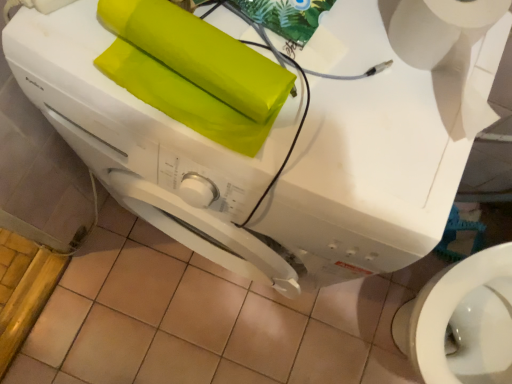
This screenshot has width=512, height=384. Find the location of `white matte toilet paper at upper right`. white matte toilet paper at upper right is located at coordinates (451, 46).

The height and width of the screenshot is (384, 512). What do you see at coordinates (451, 46) in the screenshot?
I see `white matte toilet paper at upper right` at bounding box center [451, 46].

What is the approximate height of white matte toilet paper at upper right?

The height of white matte toilet paper at upper right is 3.84 inches.

You are a GUI agent. You are given a task and a screenshot of the screen. Output one action in this format:
    pyautogui.click(x=<x>, y=<y>)
    Task: Click on the white matte toilet paper at upper right
    This screenshot has height=384, width=512.
    Given the screenshot: What is the action you would take?
    pyautogui.click(x=451, y=46)